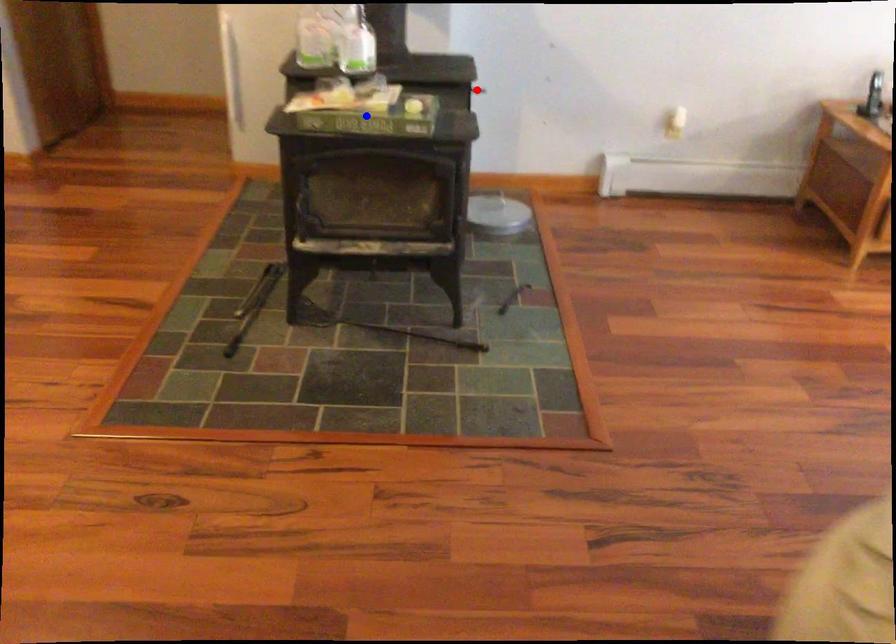
Question: Two points are marked on the image. Which point is closer to the camera?

Choices:
 (A) Blue point is closer.
 (B) Red point is closer.

Answer: (A)